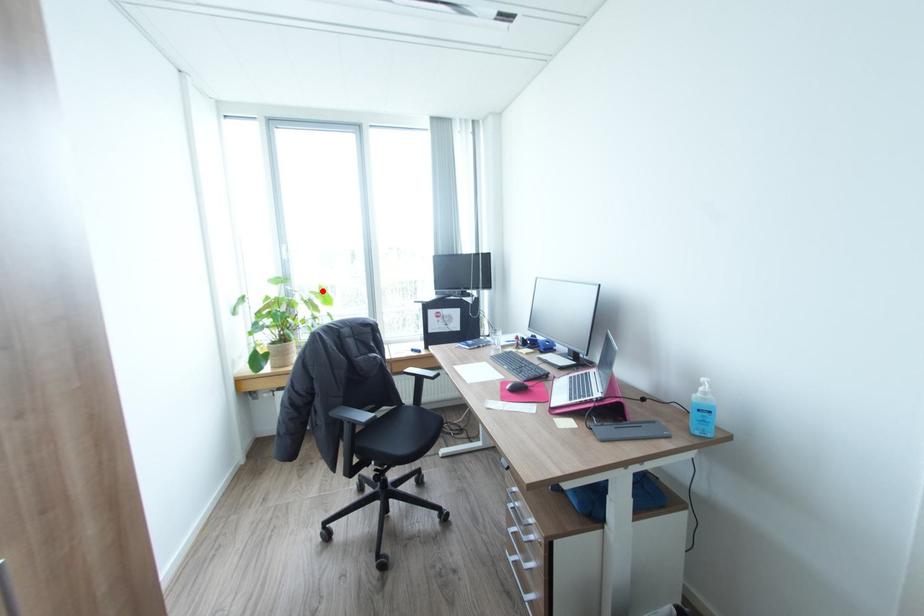
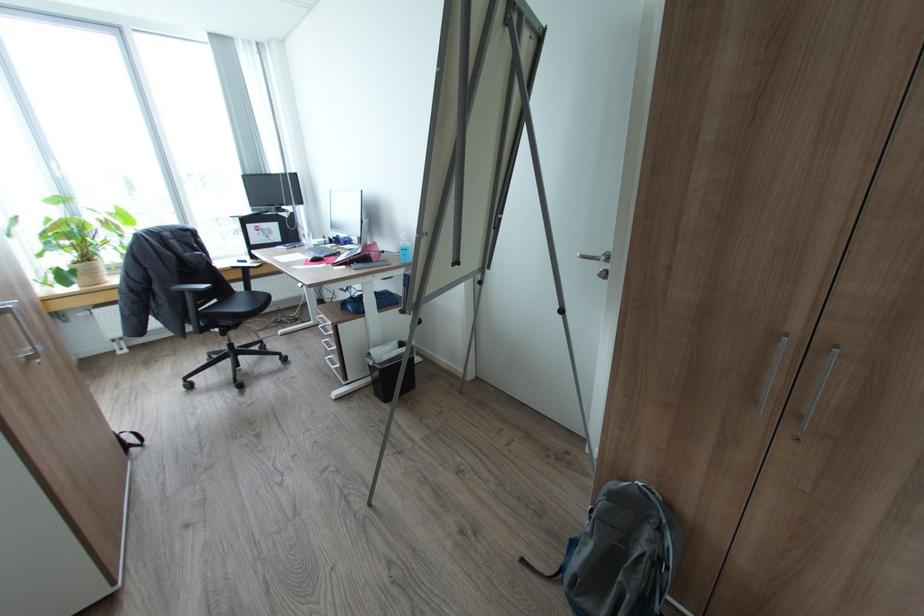
Question: I am providing you with two images of the same scene from different viewpoints. Given a red point in image1, look at the same physical point in image2. Is it:

Choices:
 (A) Closer to the viewpoint
 (B) Farther from the viewpoint

Answer: (B)